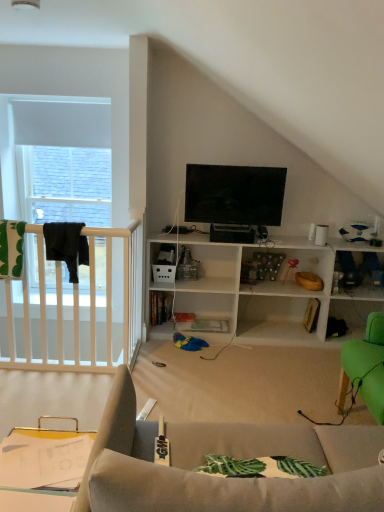
Question: Considering the positions of black fabric at left and clear plastic tray at lower left in the image, is black fabric at left taller or shorter than clear plastic tray at lower left?

Choices:
 (A) tall
 (B) short

Answer: (A)

Question: Is black fabric at left in front of or behind clear plastic tray at lower left in the image?

Choices:
 (A) behind
 (B) front

Answer: (A)

Question: Which object is the closest to the flat screen tv at upper center?

Choices:
 (A) clear plastic tray at lower left
 (B) black fabric at left

Answer: (B)

Question: Based on their relative distances, which object is nearer to the flat screen tv at upper center?

Choices:
 (A) clear plastic tray at lower left
 (B) black fabric at left

Answer: (B)